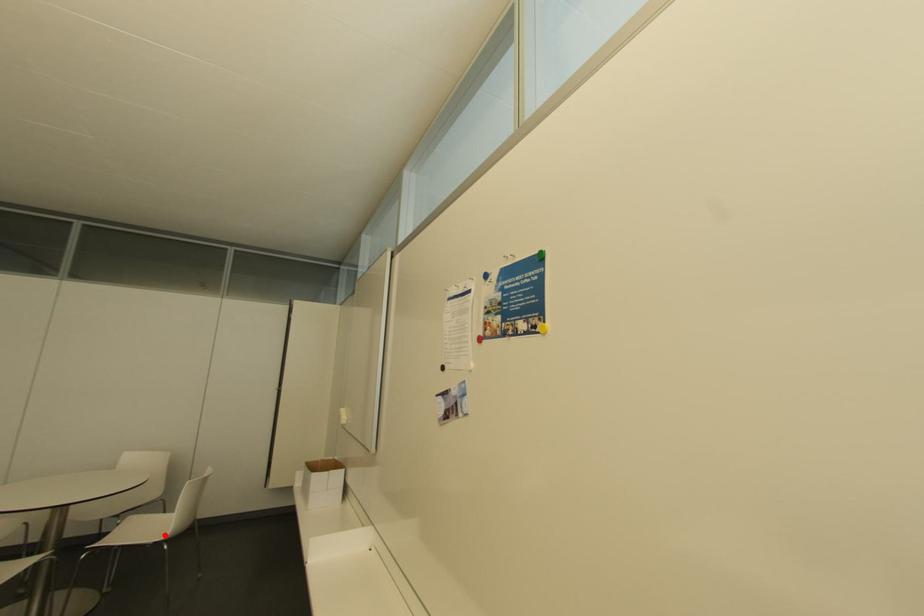
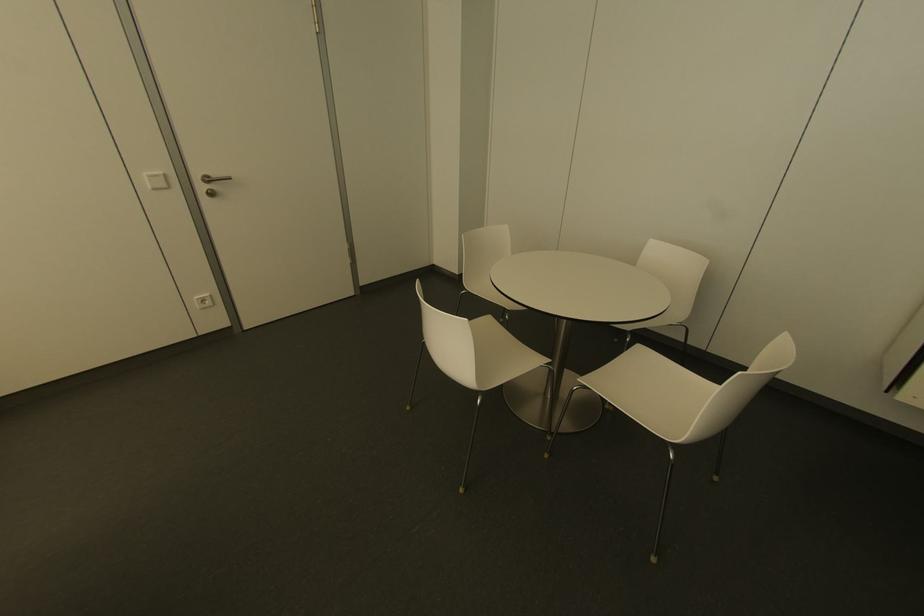
Locate, in the second image, the point that corresponds to the highlighted location in the first image.

(674, 440)